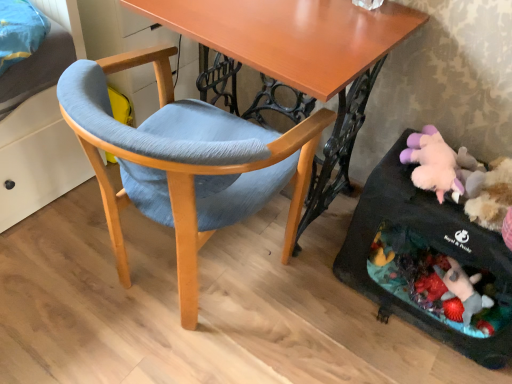
Where is `vacant space in front of wooden desk at center`? vacant space in front of wooden desk at center is located at coordinates (265, 331).